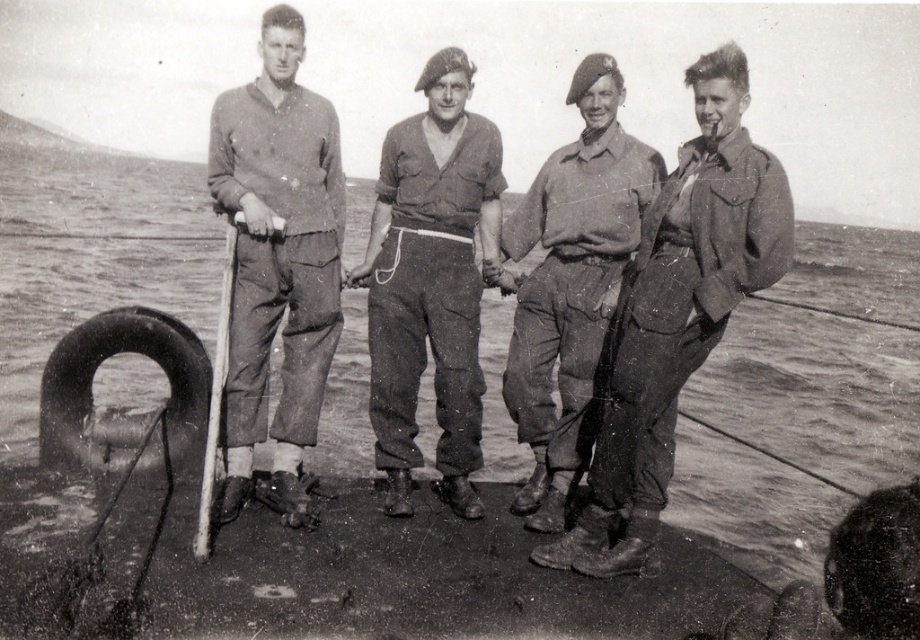
Question: Which object is closer to the camera taking this photo?

Choices:
 (A) matte khaki pants at left
 (B) black rubber tire at lower left
 (C) matte khaki beret at center
 (D) matte khaki jacket at right

Answer: (D)

Question: Is matte khaki beret at center wider than black rubber tire at lower left?

Choices:
 (A) no
 (B) yes

Answer: (A)

Question: Which of the following is the closest to the observer?

Choices:
 (A) (197, 352)
 (B) (409, 124)
 (C) (616, 388)

Answer: (C)

Question: Does matte khaki pants at left appear over matte khaki pants at center?

Choices:
 (A) no
 (B) yes

Answer: (B)

Question: Can you confirm if matte khaki jacket at right is smaller than black rubber tire at lower left?

Choices:
 (A) no
 (B) yes

Answer: (A)

Question: Based on their relative distances, which object is nearer to the matte khaki beret at center?

Choices:
 (A) matte khaki pants at left
 (B) matte khaki jacket at right

Answer: (B)